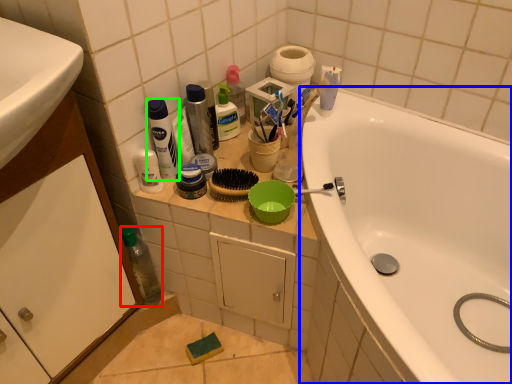
Question: Based on their relative distances, which object is farther from bottle (highlighted by a red box)? Choose from bathtub (highlighted by a blue box) and cleaning product (highlighted by a green box).

Choices:
 (A) bathtub
 (B) cleaning product

Answer: (A)